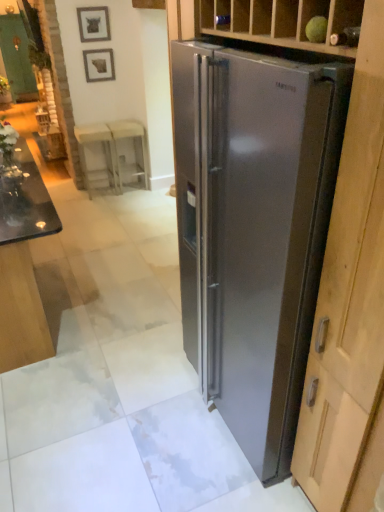
The height and width of the screenshot is (512, 384). What are the coordinates of `free space above white plastic stool at center, placed as the 2th stool when sorted from left to right (from a real-world perspective)` in the screenshot? It's located at (122, 122).